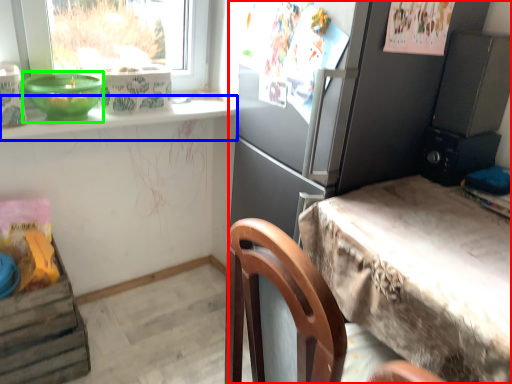
Question: Considering the real-world distances, which object is closest to cabinetry (highlighted by a red box)? window sill (highlighted by a blue box) or bowl (highlighted by a green box).

Choices:
 (A) window sill
 (B) bowl

Answer: (A)